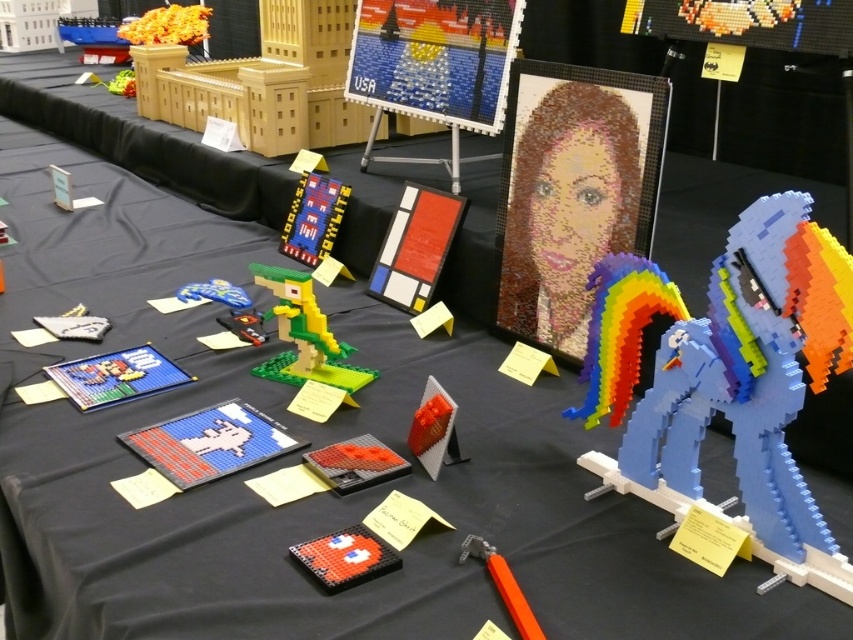
Question: Is shiny plastic rainbow-colored horse at right positioned in front of orange matte brick at center?

Choices:
 (A) yes
 (B) no

Answer: (A)

Question: Which of the following is the farthest from the observer?

Choices:
 (A) (128, 40)
 (B) (410, 422)

Answer: (A)

Question: Considering the real-world distances, which object is farthest from the shiny plastic rainbow-colored horse at right?

Choices:
 (A) orange matte brick at center
 (B) orange matte building at upper left
 (C) translucent orange cube at center
 (D) green matte lego bird at center

Answer: (B)

Question: Is shiny plastic rainbow-colored horse at right smaller than orange plastic hammer at lower center?

Choices:
 (A) no
 (B) yes

Answer: (A)

Question: Estimate the real-world distances between objects in this image. Which object is closer to the translucent orange cube at center?

Choices:
 (A) matte red brick at center
 (B) orange plastic hammer at lower center
 (C) shiny plastic rainbow-colored horse at right
 (D) orange matte building at upper left

Answer: (A)

Question: Can you confirm if matte red brick at center is positioned above orange matte brick at center?

Choices:
 (A) yes
 (B) no

Answer: (B)